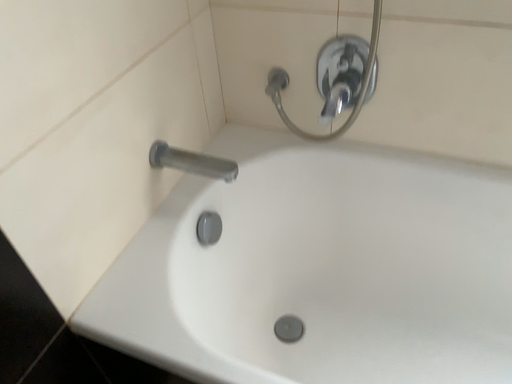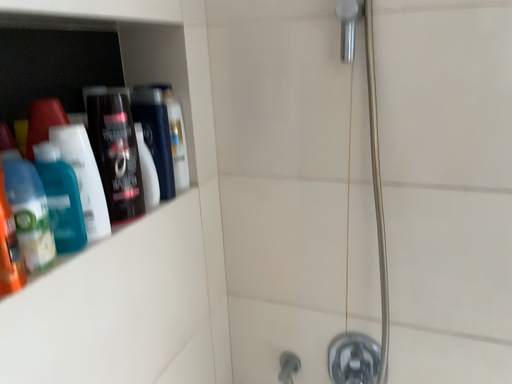
Question: Which way did the camera rotate in the video?

Choices:
 (A) rotated downward
 (B) rotated upward

Answer: (B)